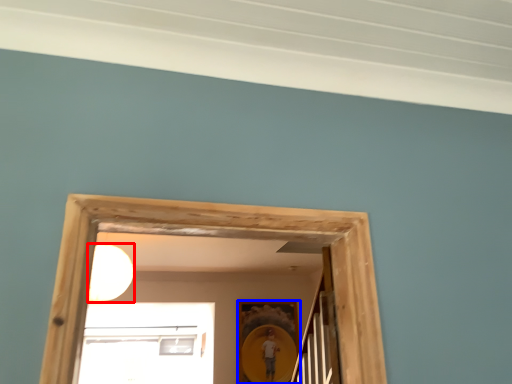
Question: Which object appears farthest to the camera in this image, light (highlighted by a red box) or picture frame (highlighted by a blue box)?

Choices:
 (A) light
 (B) picture frame

Answer: (B)